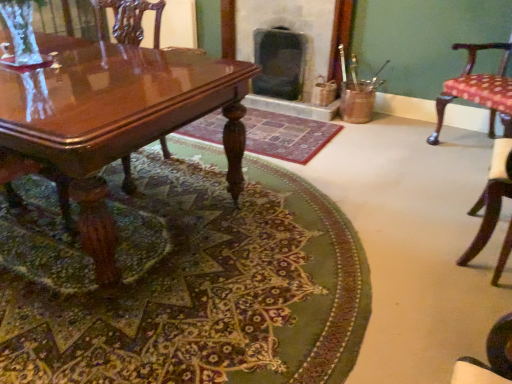
Where is `vacant space in between polka dot fabric chair at right, which is counted as the 3th chair, starting from the left, and patterned fabric cushion at right, which appears as the 2th chair when viewed from the left`? The image size is (512, 384). vacant space in between polka dot fabric chair at right, which is counted as the 3th chair, starting from the left, and patterned fabric cushion at right, which appears as the 2th chair when viewed from the left is located at coordinates (448, 184).